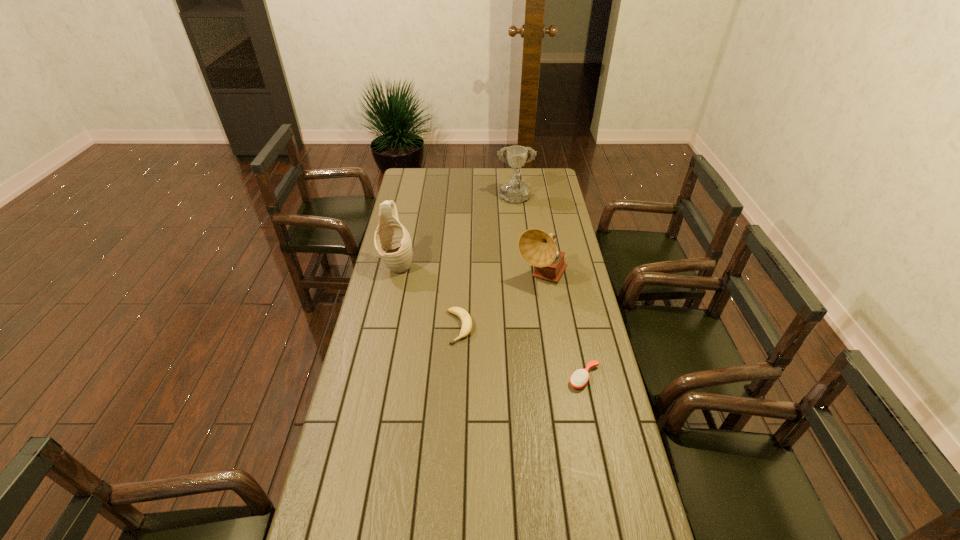
You are a GUI agent. You are given a task and a screenshot of the screen. Output one action in this format:
    pyautogui.click(x=<x>, y=<y>)
    Task: Click on the vacant region located on the back of the second object from left to right
    The height and width of the screenshot is (540, 960).
    Given the screenshot: What is the action you would take?
    pyautogui.click(x=462, y=282)

Identify the location of object that is at the left edge. (392, 241).

Image resolution: width=960 pixels, height=540 pixels. Find the location of `award situated at the right edge`. award situated at the right edge is located at coordinates (514, 192).

Locate an element on the screen. This screenshot has height=540, width=960. phonograph record present at the right edge is located at coordinates (538, 248).

Identify the location of hairbrush present at the right edge. The width and height of the screenshot is (960, 540). (x=580, y=377).

I want to click on vacant region at the left edge, so click(381, 431).

Image resolution: width=960 pixels, height=540 pixels. In the image, there is a desktop. What are the coordinates of `vacant space at the right edge` in the screenshot? It's located at (595, 447).

What are the coordinates of `free space at the far right corner` in the screenshot? It's located at (527, 174).

Where is `unoccupied position between the hairbrush and the second nearest object`? unoccupied position between the hairbrush and the second nearest object is located at coordinates (521, 353).

At what (x,y) coordinates should I click in order to perform the action: click on vacant space that is in between the pitcher and the award. Please return your answer as a coordinate pair (x, y). Looking at the image, I should click on (456, 233).